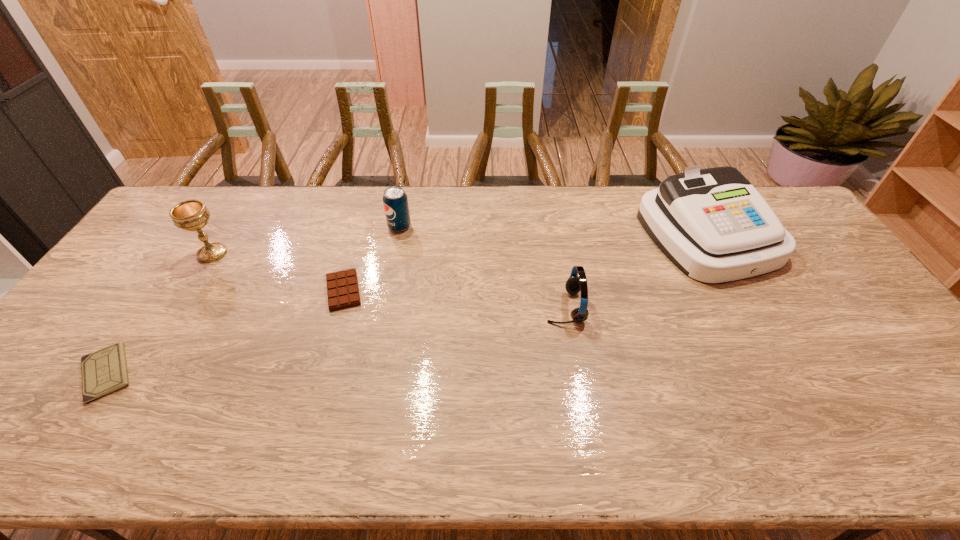
The height and width of the screenshot is (540, 960). Identify the location of free space that satisfies the following two spatial constraints: 1. on the back side of the chalice; 2. on the right side of the soda can. (229, 227).